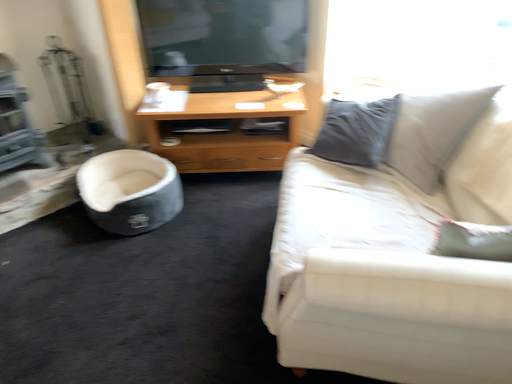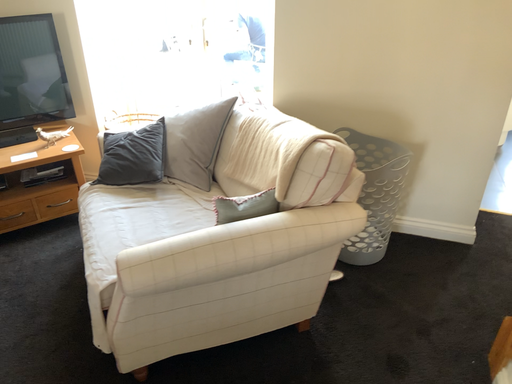
Question: Which way did the camera rotate in the video?

Choices:
 (A) rotated right
 (B) rotated left

Answer: (A)